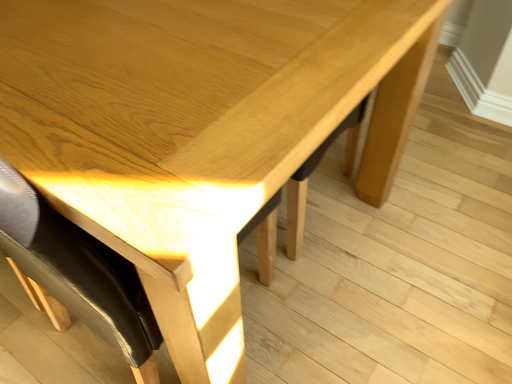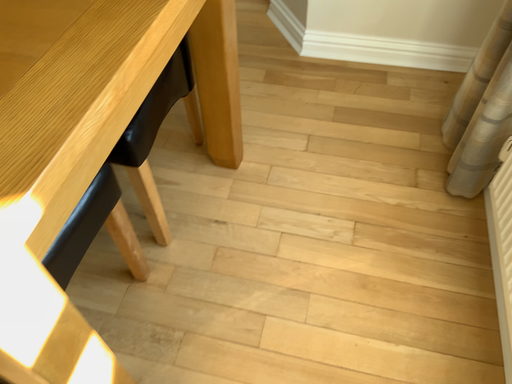
Question: Which way did the camera rotate in the video?

Choices:
 (A) rotated left
 (B) rotated right

Answer: (B)